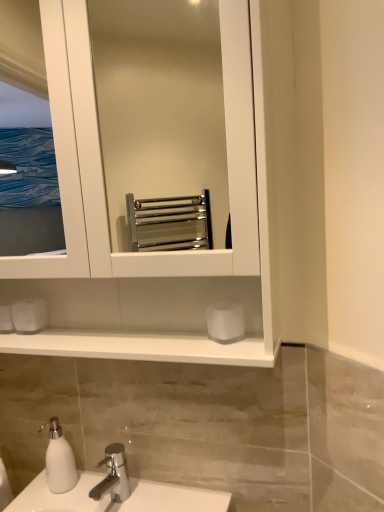
Question: Is white matte soap dispenser at lower left to the right of white glossy towel rack at center from the viewer's perspective?

Choices:
 (A) no
 (B) yes

Answer: (A)

Question: Is white matte soap dispenser at lower left looking in the opposite direction of white glossy towel rack at center?

Choices:
 (A) no
 (B) yes

Answer: (A)

Question: From a real-world perspective, is white matte soap dispenser at lower left under white glossy towel rack at center?

Choices:
 (A) yes
 (B) no

Answer: (A)

Question: Is the position of white matte soap dispenser at lower left more distant than that of white glossy towel rack at center?

Choices:
 (A) yes
 (B) no

Answer: (A)

Question: From a real-world perspective, is white matte soap dispenser at lower left on white glossy towel rack at center?

Choices:
 (A) no
 (B) yes

Answer: (A)

Question: Looking at their shapes, would you say silver metallic tap at lower center is wider or thinner than white glossy towel rack at center?

Choices:
 (A) wide
 (B) thin

Answer: (A)

Question: From the image's perspective, is silver metallic tap at lower center above or below white glossy towel rack at center?

Choices:
 (A) below
 (B) above

Answer: (A)

Question: From a real-world perspective, is silver metallic tap at lower center positioned above or below white glossy towel rack at center?

Choices:
 (A) below
 (B) above

Answer: (A)

Question: Based on their sizes in the image, would you say silver metallic tap at lower center is bigger or smaller than white glossy towel rack at center?

Choices:
 (A) big
 (B) small

Answer: (B)

Question: From the image's perspective, is white glossy towel rack at center positioned above or below white matte toilet paper at lower left, acting as the second toilet paper starting from the front?

Choices:
 (A) above
 (B) below

Answer: (A)

Question: Considering their positions, is white glossy towel rack at center located in front of or behind white matte toilet paper at lower left, the first toilet paper positioned from the left?

Choices:
 (A) behind
 (B) front

Answer: (B)

Question: Considering the positions of point (258, 151) and point (39, 302), is point (258, 151) closer or farther from the camera than point (39, 302)?

Choices:
 (A) farther
 (B) closer

Answer: (B)

Question: From a real-world perspective, is white glossy towel rack at center physically located above or below white matte toilet paper at lower left, the first toilet paper from the back?

Choices:
 (A) below
 (B) above

Answer: (B)

Question: Considering the positions of white glossy towel rack at center and white matte soap dispenser at lower left in the image, is white glossy towel rack at center wider or thinner than white matte soap dispenser at lower left?

Choices:
 (A) wide
 (B) thin

Answer: (A)

Question: Is white glossy towel rack at center in front of or behind white matte soap dispenser at lower left in the image?

Choices:
 (A) front
 (B) behind

Answer: (A)